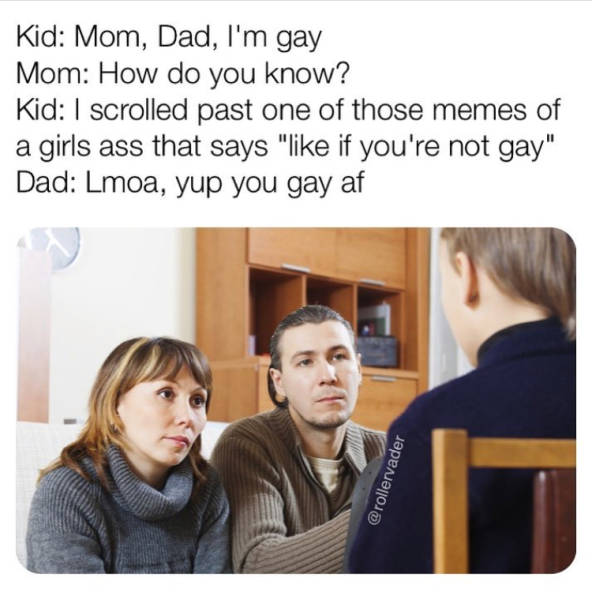
What are the coordinates of `chair` in the screenshot? It's located at (452, 508).